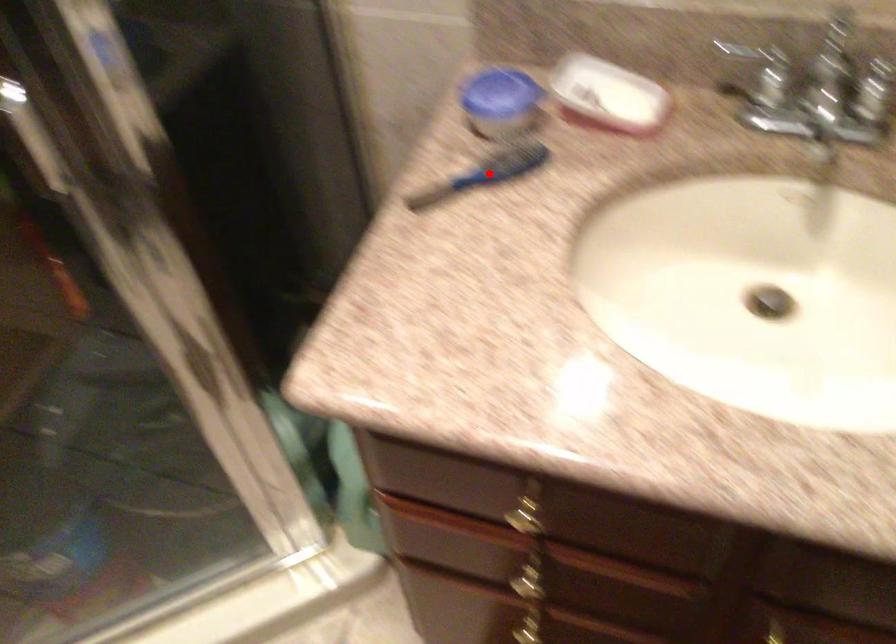
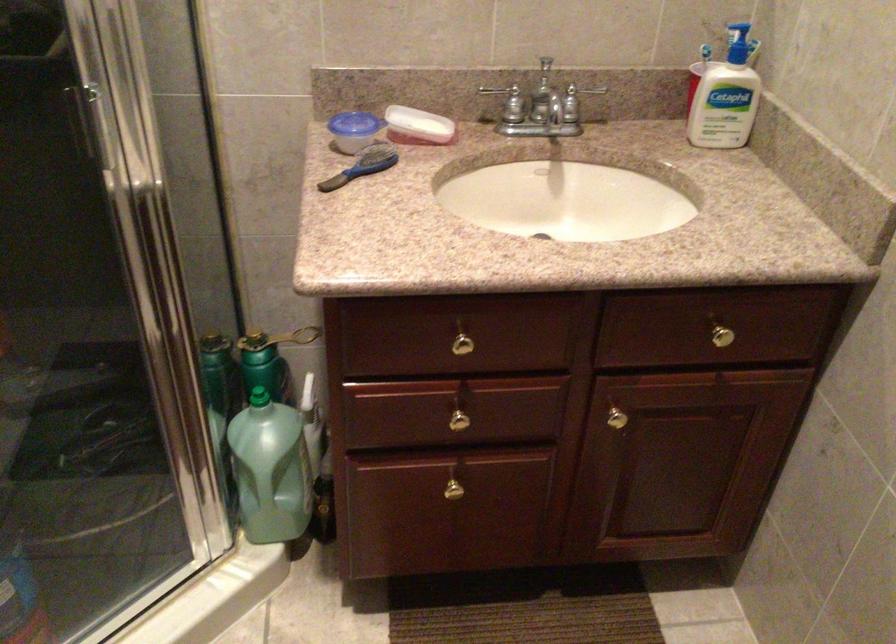
The point at the highlighted location is marked in the first image. Where is the corresponding point in the second image?

(364, 166)